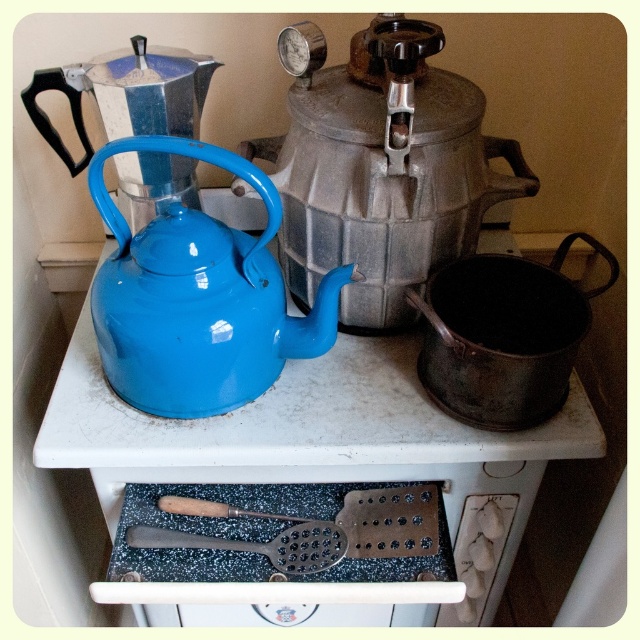
Who is more forward, [316,184] or [381,540]?

Point [381,540]

Is metallic silver teapot at center to the right of wooden-handled metal spatula at lower center from the viewer's perspective?

Indeed, metallic silver teapot at center is positioned on the right side of wooden-handled metal spatula at lower center.

Between point (404, 189) and point (371, 541), which one is positioned in front?

Point (404, 189) is more forward.

This screenshot has height=640, width=640. Identify the location of metallic silver teapot at center. (380, 166).

Which is behind, point (358, 352) or point (396, 33)?

The point (358, 352) is more distant.

Which is more to the left, blue enamel kettle at upper left or metallic silver teapot at center?

Positioned to the left is blue enamel kettle at upper left.

Who is more distant from viewer, (547,444) or (369,161)?

Point (547,444)

Locate an element on the screen. Image resolution: width=640 pixels, height=640 pixels. blue enamel kettle at upper left is located at coordinates [x=307, y=477].

Is point (486, 554) positioned in front of point (259, 516)?

No, (486, 554) is further to viewer.

Measure the distance between blue enamel kettle at upper left and camera.

blue enamel kettle at upper left is 26.82 inches from camera.

The width and height of the screenshot is (640, 640). Find the location of `blue enamel kettle at upper left`. blue enamel kettle at upper left is located at coordinates (307, 477).